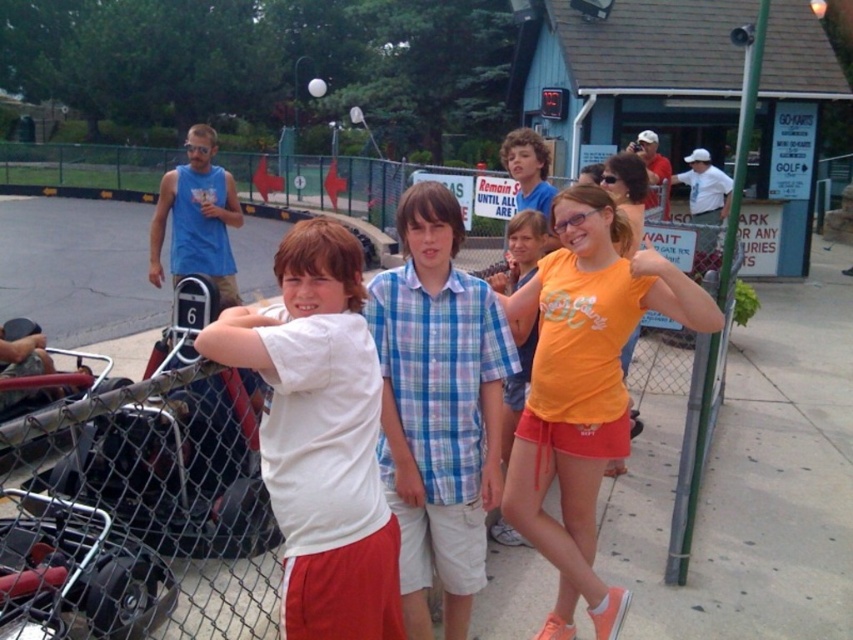
You are standing at the point with coordinates (583, 388) in the image. What object is located at this point?

The point at (583, 388) corresponds to the orange matte t shirt at center.

You are a photographer trying to capture a group photo of the children. Since the white matte shirt at center and the blue plaid shirt at center are both at center, which child should you ask to move slightly upwards to avoid overlapping?

The white matte shirt at center is below the blue plaid shirt at center, so you should ask the child wearing the white matte shirt at center to move slightly upwards to avoid overlapping.